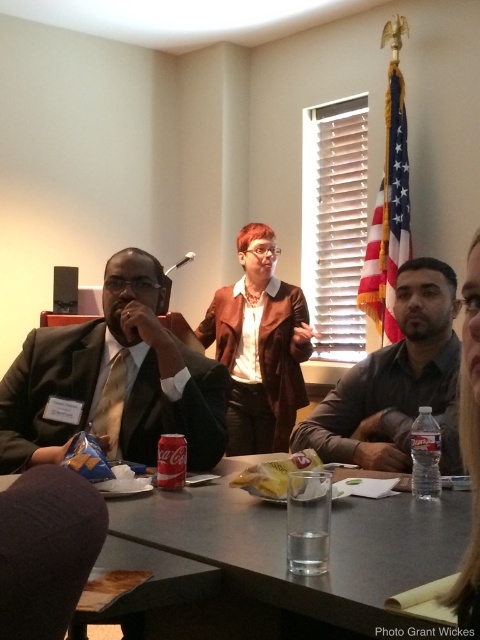
Does smooth gray table at center appear on the right side of dark gray fabric at lower left?

Answer: Correct, you'll find smooth gray table at center to the right of dark gray fabric at lower left.

Does smooth gray table at center appear under dark gray fabric at lower left?

Yes, smooth gray table at center is below dark gray fabric at lower left.

Does point (397, 620) come in front of point (2, 618)?

No.

At what (x,y) coordinates should I click in order to perform the action: click on smooth gray table at center. Please return your answer as a coordinate pair (x, y). This screenshot has height=640, width=480. Looking at the image, I should click on (285, 547).

Does smooth gray table at center appear under matte brown leather jacket at upper center?

Indeed, smooth gray table at center is positioned under matte brown leather jacket at upper center.

Is point (243, 496) positioned behind point (471, 416)?

Yes, point (243, 496) is farther from viewer.

Identify the location of smooth gray table at center. (285, 547).

Is point (343, 568) positioned in front of point (43, 353)?

Yes, it is in front of point (43, 353).

Is point (144, 525) less distant than point (166, 362)?

Yes, it is.

Find the location of a particular element. smooth gray table at center is located at coordinates (285, 547).